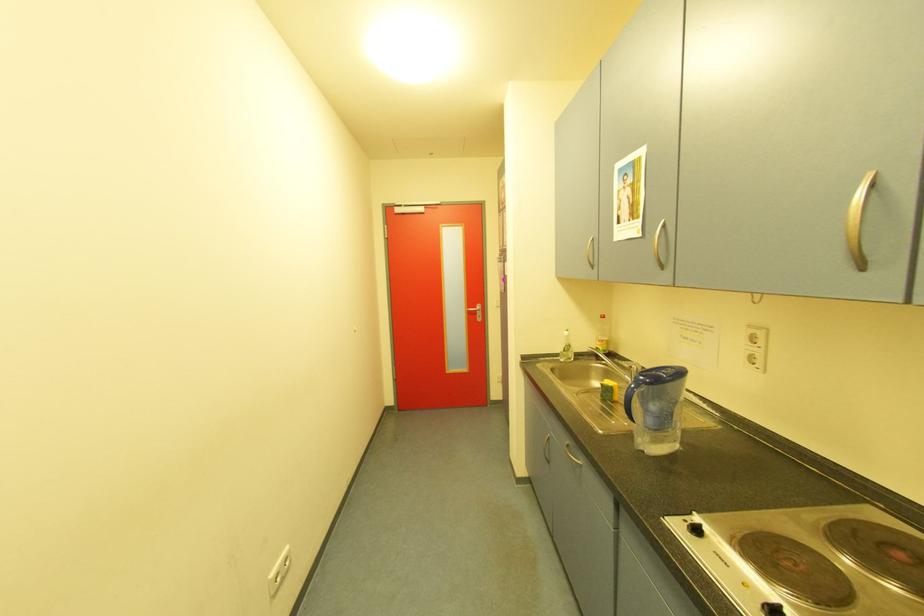
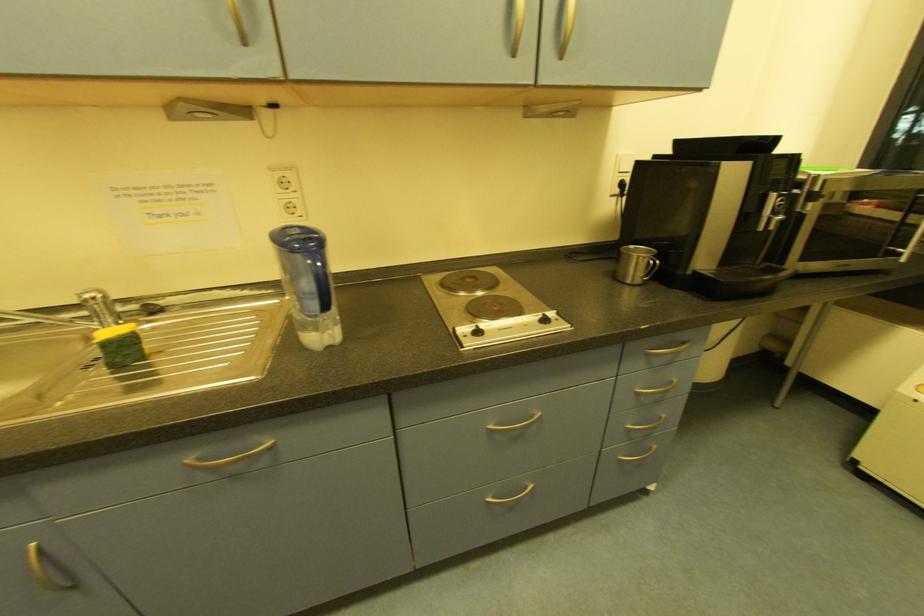
How did the camera likely rotate?

The rotation direction of the camera is right-down.